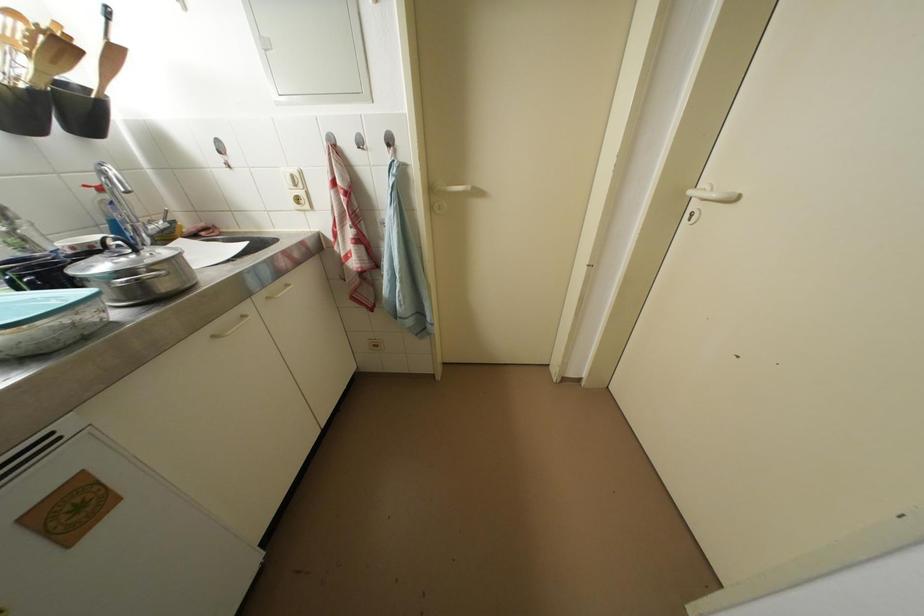
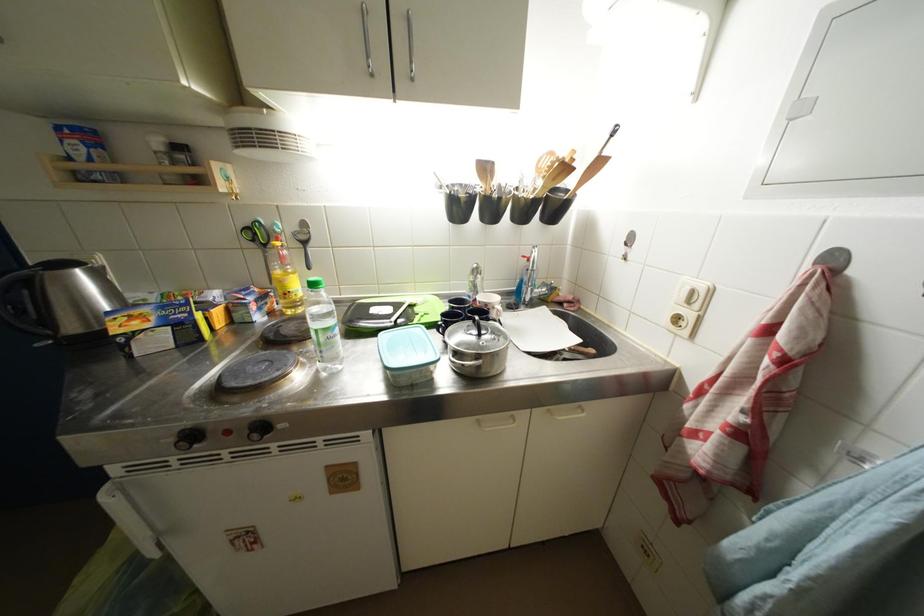
Where in the second image is the point corresponding to [301,188] from the first image?

(696, 306)